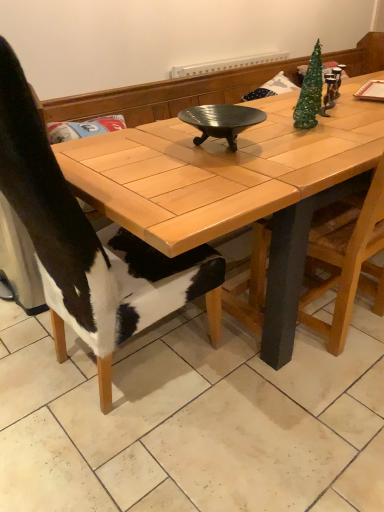
At what (x,y) coordinates should I click in order to perform the action: click on free spot in front of wooden chair at right, the 1th chair in the right-to-left sequence. Please return your answer as a coordinate pair (x, y). The width and height of the screenshot is (384, 512). Looking at the image, I should click on (326, 389).